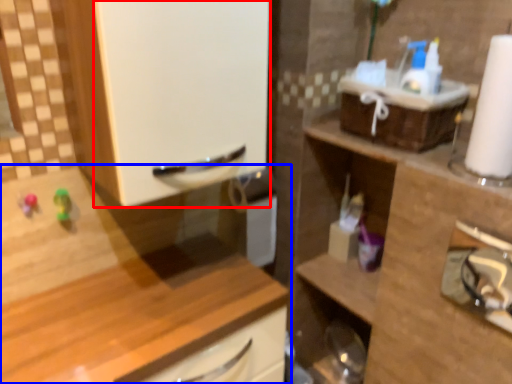
Question: Which object appears farthest to the camera in this image, screen door (highlighted by a red box) or cabinetry (highlighted by a blue box)?

Choices:
 (A) screen door
 (B) cabinetry

Answer: (A)